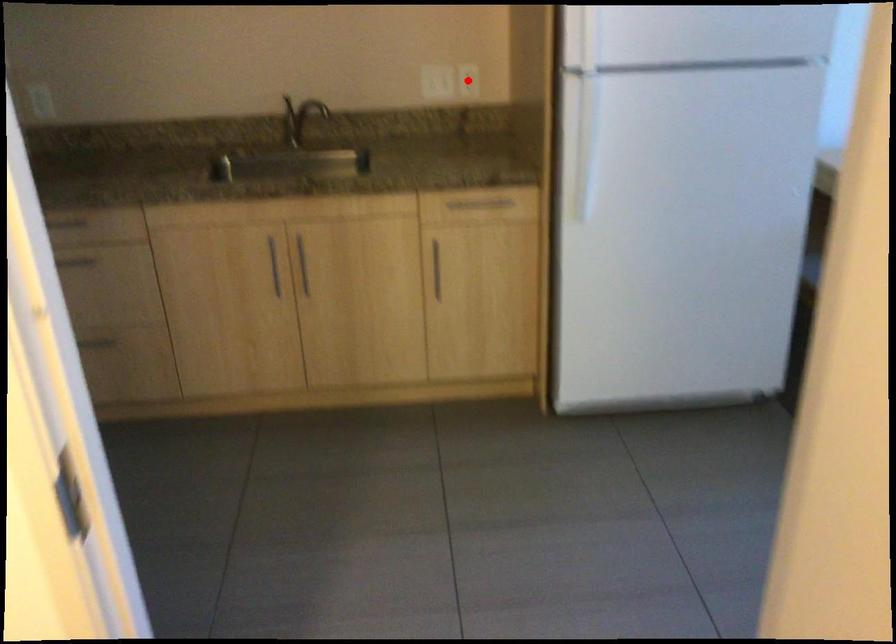
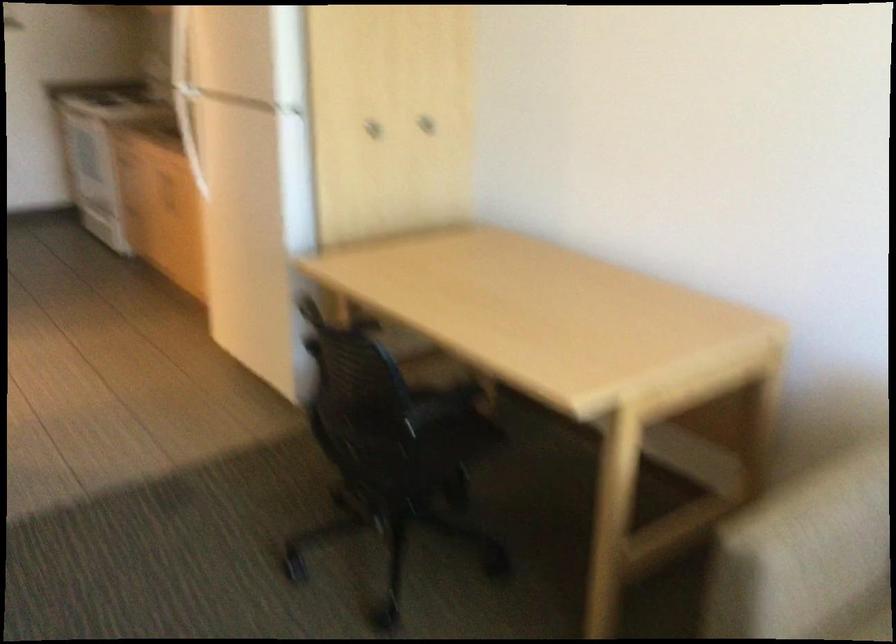
Question: I am providing you with two images of the same scene from different viewpoints. A red point is marked on the first image. Is the red point's position out of view in image 2?

Choices:
 (A) Yes
 (B) No

Answer: (A)